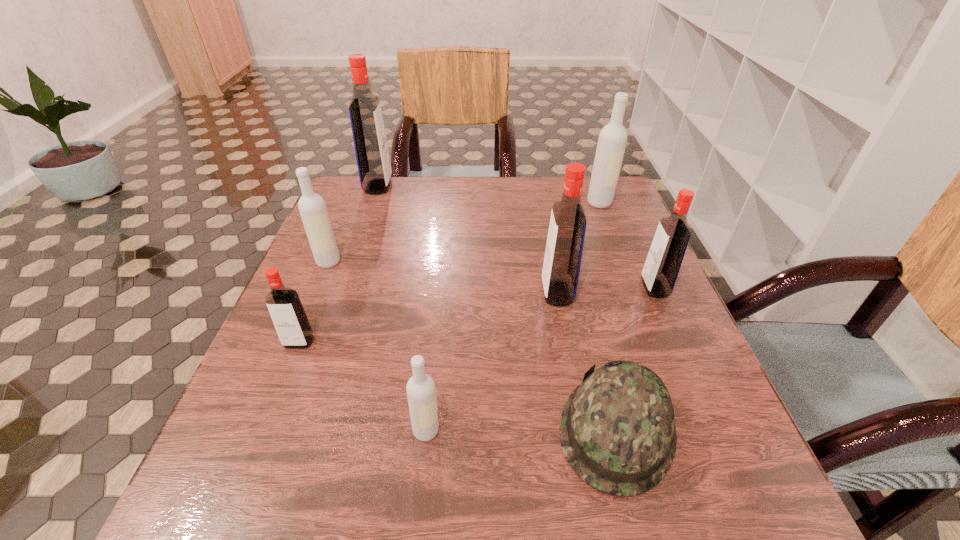
Find the location of a particular element. Image resolution: width=960 pixels, height=540 pixels. object present at the near right corner is located at coordinates (617, 430).

Identify the location of vacant space at the far edge of the desktop. Image resolution: width=960 pixels, height=540 pixels. (476, 181).

The height and width of the screenshot is (540, 960). What are the coordinates of `vacant region at the left edge of the desktop` in the screenshot? It's located at (276, 375).

This screenshot has height=540, width=960. In the image, there is a desktop. In order to click on vacant space at the right edge in this screenshot , I will do `click(682, 354)`.

In the image, there is a desktop. What are the coordinates of `vacant space at the near left corner` in the screenshot? It's located at (233, 499).

Locate an element on the screen. This screenshot has height=540, width=960. unoccupied position between the third farthest vodka and the tallest object is located at coordinates (353, 224).

The width and height of the screenshot is (960, 540). What are the coordinates of `vacant area between the leftmost white vodka and the third smallest red vodka` in the screenshot? It's located at coord(443,278).

Where is `vacant area that lies between the fifth object from right to left and the headwear`? The height and width of the screenshot is (540, 960). vacant area that lies between the fifth object from right to left and the headwear is located at coordinates (521, 430).

Where is `vacant area that lies between the third farthest object and the second biggest red vodka`? vacant area that lies between the third farthest object and the second biggest red vodka is located at coordinates (443, 278).

I want to click on vacant area that lies between the rightmost white vodka and the fourth object from left to right, so click(x=513, y=316).